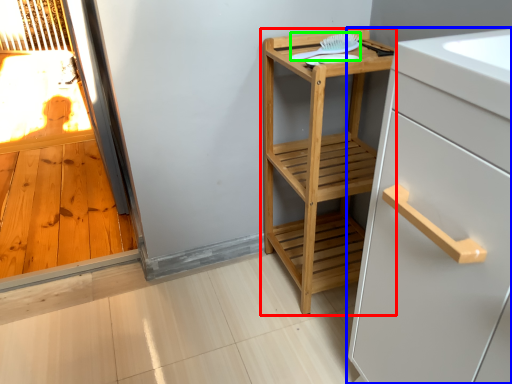
Question: Based on their relative distances, which object is nearer to furniture (highlighted by a red box)? Choose from cabinetry (highlighted by a blue box) and brush (highlighted by a green box).

Choices:
 (A) cabinetry
 (B) brush

Answer: (B)